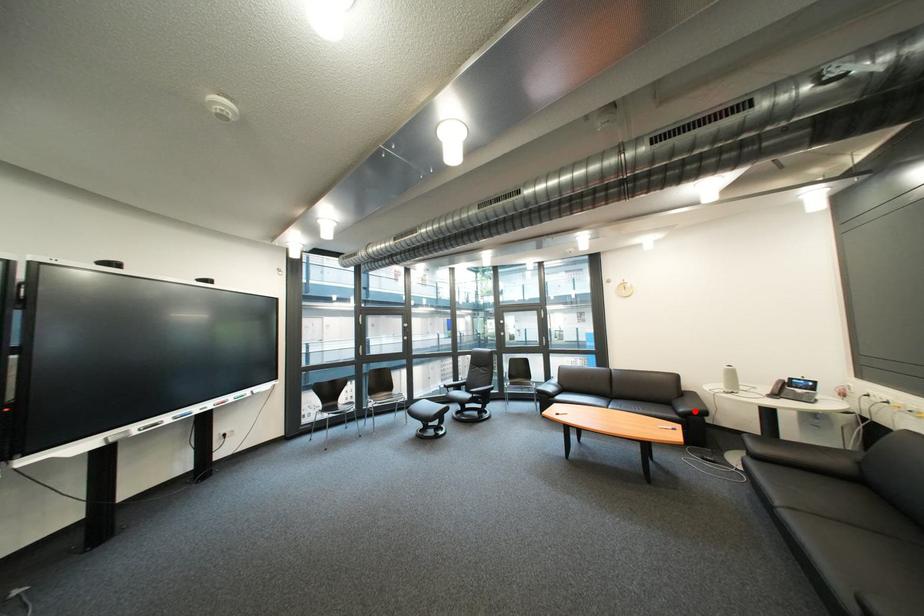
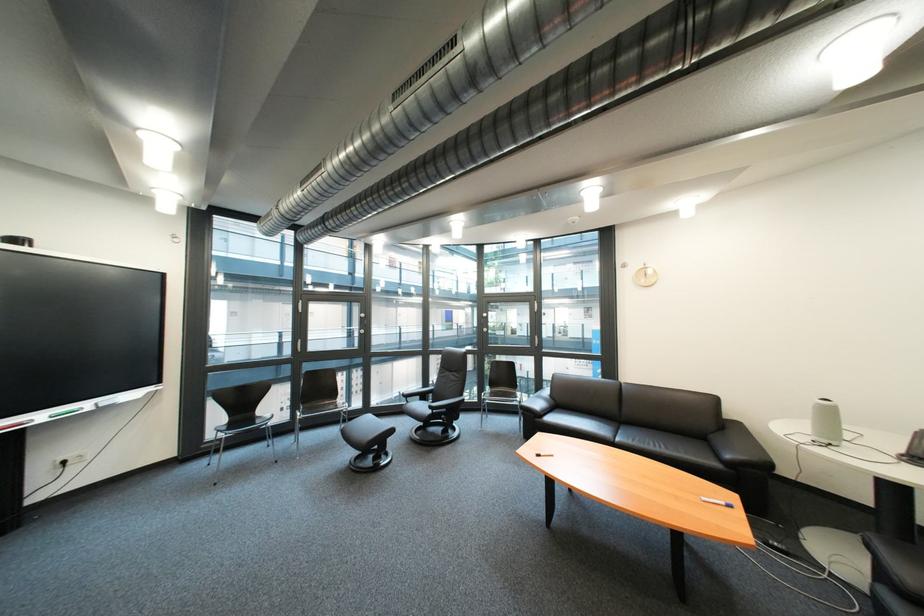
Question: I am providing you with two images of the same scene from different viewpoints. Given a red point in image1, look at the same physical point in image2. Is it:

Choices:
 (A) Closer to the viewpoint
 (B) Farther from the viewpoint

Answer: (B)